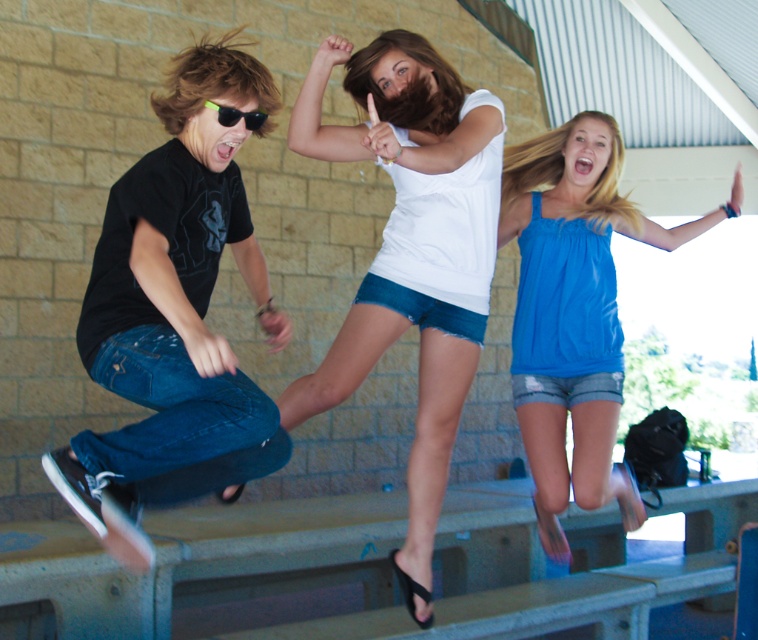
From the picture: You are a photographer trying to capture a candid shot of the people jumping off the bleachers. You notice the black plastic sunglasses at left and the white matte tank top at center in your viewfinder. Which object is closer to the camera?

The white matte tank top at center is closer to the camera because the black plastic sunglasses at left is behind it.